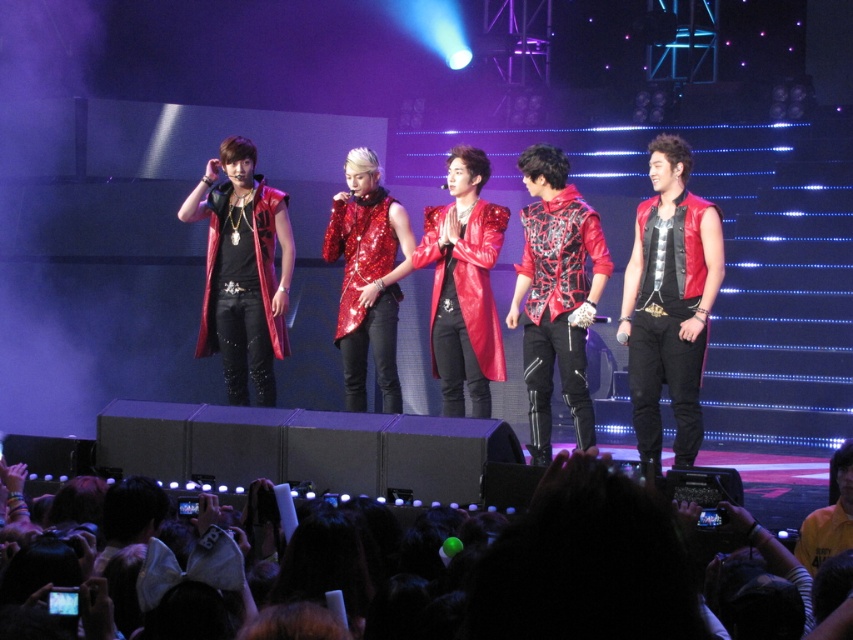
Between point (648, 172) and point (846, 500), which one is positioned in front?

Point (846, 500) is in front.

Is shiny red vest at right thinner than black fabric crowd at lower center?

In fact, shiny red vest at right might be wider than black fabric crowd at lower center.

Does point (650, 276) come behind point (10, 541)?

Yes.

This screenshot has height=640, width=853. I want to click on shiny red vest at right, so click(669, 300).